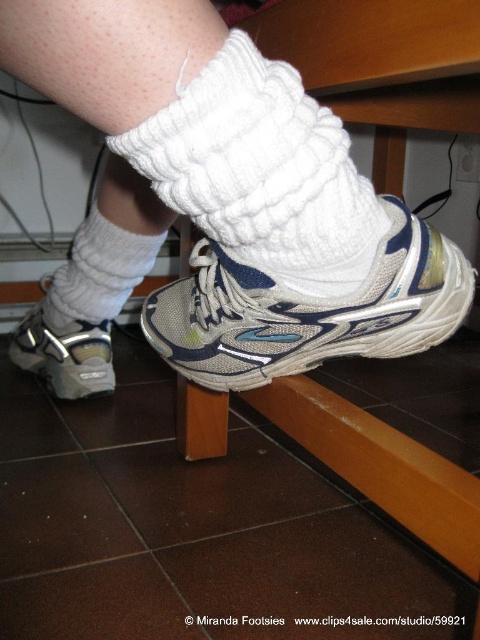
You are a photographer trying to capture the texture of the white knitted socks at center and the white knitted sock at center. Which one is positioned lower in the image?

The white knitted socks at center is located below the white knitted sock at center, so the white knitted socks at center is positioned lower in the image.

You are trying to choose between two white knitted socks in the image. The white knitted sock at center and the white knitted sock at lower center. Which sock is wider?

The white knitted sock at lower center is wider than the white knitted sock at center.